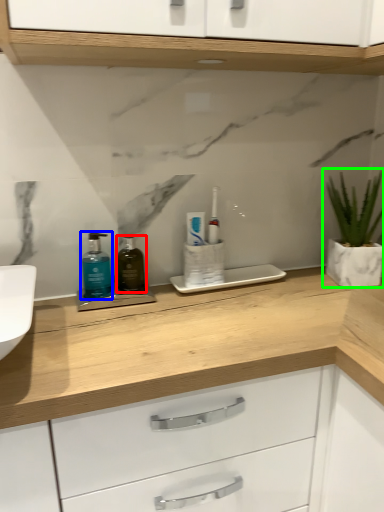
Question: Considering the real-world distances, which object is closest to mouthwash (highlighted by a red box)? mouthwash (highlighted by a blue box) or houseplant (highlighted by a green box).

Choices:
 (A) mouthwash
 (B) houseplant

Answer: (A)